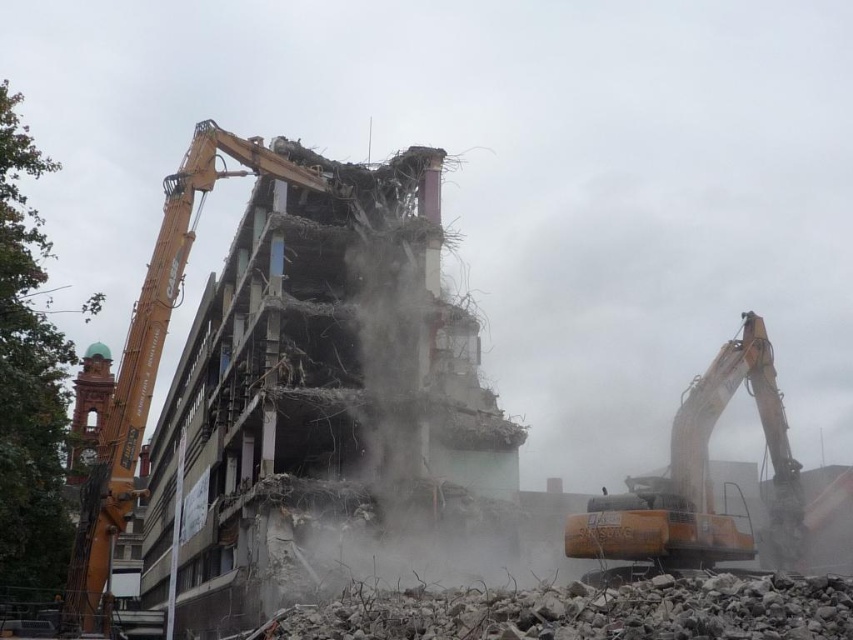
You are a construction worker observing the demolition site. You need to choose a machine to move a heavy beam. Which machine should you choose between the orange metallic excavator at right and the orange metallic crane at left?

The orange metallic crane at left is larger than the orange metallic excavator at right, so you should choose the orange metallic crane at left to move the heavy beam.

From the picture: You are a construction worker standing at the center of the demolition site. You notice two points marked in the image. The first point is at coordinates point (721, 532) and the second is at point (105, 529). Which point is closer to you?

Point (721, 532) is in front of point (105, 529), so it is closer to you.